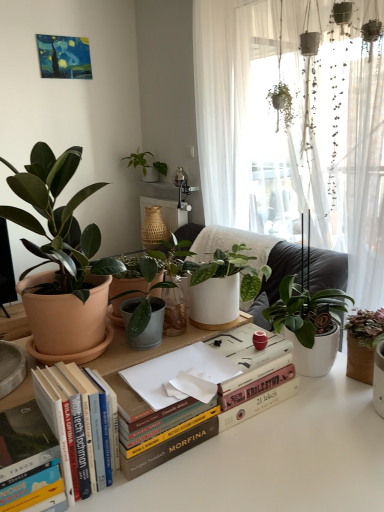
Question: Is hardcover books at center taller than green matte plant at right, the third houseplant from the top?

Choices:
 (A) no
 (B) yes

Answer: (A)

Question: Can you confirm if hardcover books at center is bigger than green matte plant at right, positioned as the 1th houseplant in right-to-left order?

Choices:
 (A) no
 (B) yes

Answer: (A)

Question: Is hardcover books at center far away from green matte plant at right, the 3th houseplant from the left?

Choices:
 (A) no
 (B) yes

Answer: (A)

Question: Is hardcover books at center outside green matte plant at right, positioned as the 1th houseplant in right-to-left order?

Choices:
 (A) yes
 (B) no

Answer: (A)

Question: From the image's perspective, would you say hardcover books at center is shown under green matte plant at right, placed as the 2th houseplant when sorted from front to back?

Choices:
 (A) no
 (B) yes

Answer: (B)

Question: Looking at the image, does hardcover book at lower left, the second paperback book viewed from the top, seem bigger or smaller compared to matte terracotta pot at left, which is the 2th houseplant in bottom-to-top order?

Choices:
 (A) big
 (B) small

Answer: (B)

Question: From the image's perspective, is hardcover book at lower left, which is the 1th paperback book in left-to-right order, positioned above or below matte terracotta pot at left, which is counted as the 2th houseplant, starting from the top?

Choices:
 (A) above
 (B) below

Answer: (B)

Question: In terms of width, does hardcover book at lower left, which is the 1th paperback book in left-to-right order, look wider or thinner when compared to matte terracotta pot at left, which is the 1th houseplant in front-to-back order?

Choices:
 (A) thin
 (B) wide

Answer: (A)

Question: From a real-world perspective, is hardcover book at lower left, which is the 1th paperback book in left-to-right order, physically located above or below matte terracotta pot at left, which is the 2th houseplant in bottom-to-top order?

Choices:
 (A) above
 (B) below

Answer: (B)

Question: From a real-world perspective, is hardcover book at lower left, the 1th paperback book from the bottom, positioned above or below green matte plant at upper center, marked as the 3th houseplant in a bottom-to-top arrangement?

Choices:
 (A) below
 (B) above

Answer: (A)

Question: Does point (41, 478) appear closer or farther from the camera than point (152, 157)?

Choices:
 (A) closer
 (B) farther

Answer: (A)

Question: Looking at their shapes, would you say hardcover book at lower left, the 1th paperback book from the bottom, is wider or thinner than green matte plant at upper center, the 3th houseplant viewed from the right?

Choices:
 (A) thin
 (B) wide

Answer: (A)

Question: Is hardcover book at lower left, which is the 1th paperback book in left-to-right order, inside or outside of green matte plant at upper center, the 3th houseplant viewed from the right?

Choices:
 (A) outside
 (B) inside

Answer: (A)

Question: Is point tap(370, 318) closer or farther from the camera than point tap(134, 153)?

Choices:
 (A) closer
 (B) farther

Answer: (A)

Question: Looking at their shapes, would you say green matte plant at right, the third houseplant from the top, is wider or thinner than green matte plant at upper center, the 3th houseplant viewed from the right?

Choices:
 (A) thin
 (B) wide

Answer: (A)